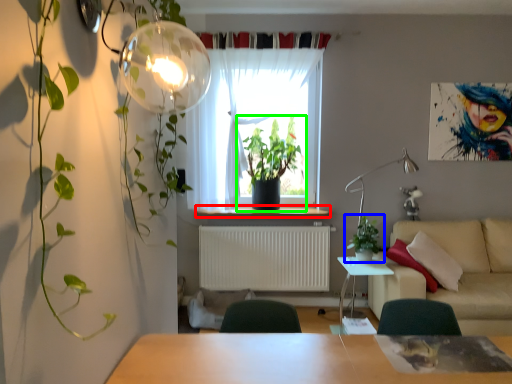
Question: Which object is positioned farthest from window sill (highlighted by a red box)? Select from houseplant (highlighted by a blue box) and houseplant (highlighted by a green box).

Choices:
 (A) houseplant
 (B) houseplant

Answer: (A)